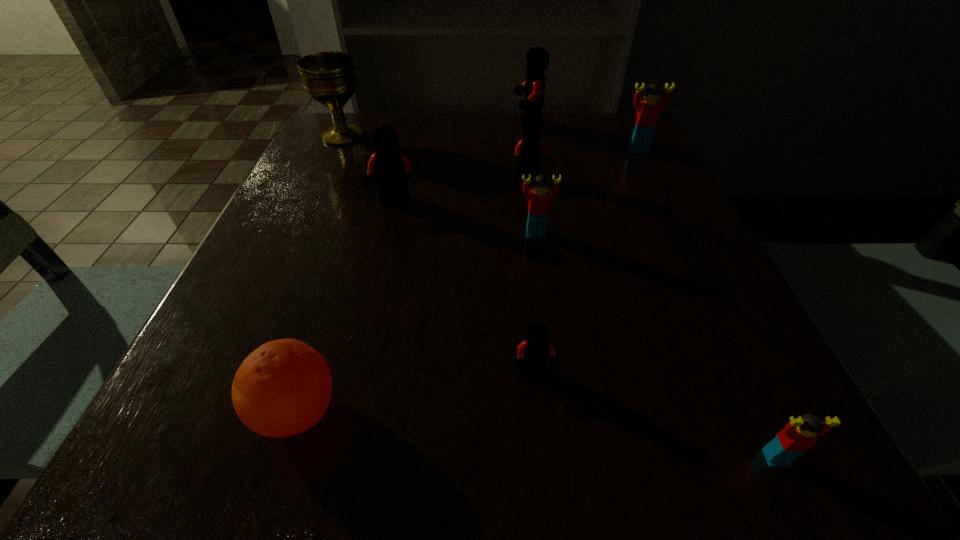
Locate an element on the screen. This screenshot has height=540, width=960. object located at the far left corner is located at coordinates (329, 78).

Locate an element on the screen. object at the near left corner is located at coordinates (283, 388).

You are a GUI agent. You are given a task and a screenshot of the screen. Output one action in this format:
    pyautogui.click(x=<x>, y=<y>)
    Task: Click on the object situated at the far right corner
    This screenshot has height=540, width=960.
    Given the screenshot: What is the action you would take?
    pyautogui.click(x=648, y=110)

At what (x,y) coordinates should I click in order to perform the action: click on object present at the near right corner. Please return your answer as a coordinate pair (x, y). This screenshot has height=540, width=960. Looking at the image, I should click on (798, 436).

You are a GUI agent. You are given a task and a screenshot of the screen. Output one action in this format:
    pyautogui.click(x=<x>, y=<y>)
    Task: Click on the blank space at the far edge of the desktop
    
    Given the screenshot: What is the action you would take?
    pyautogui.click(x=495, y=143)

This screenshot has height=540, width=960. In the image, there is a desktop. What are the coordinates of `vacant space at the left edge` in the screenshot? It's located at (352, 179).

This screenshot has height=540, width=960. In the image, there is a desktop. What are the coordinates of `free space at the right edge` in the screenshot? It's located at (668, 193).

Identify the location of vacant space at the near left corner of the desktop. The height and width of the screenshot is (540, 960). (212, 429).

You are a GUI agent. You are given a task and a screenshot of the screen. Output one action in this format:
    pyautogui.click(x=<x>, y=<y>)
    Task: Click on the blank area at the far right corner
    The height and width of the screenshot is (540, 960).
    Given the screenshot: What is the action you would take?
    click(x=613, y=122)

In order to click on free space between the orange orange and the nearest Lego in this screenshot , I will do `click(537, 435)`.